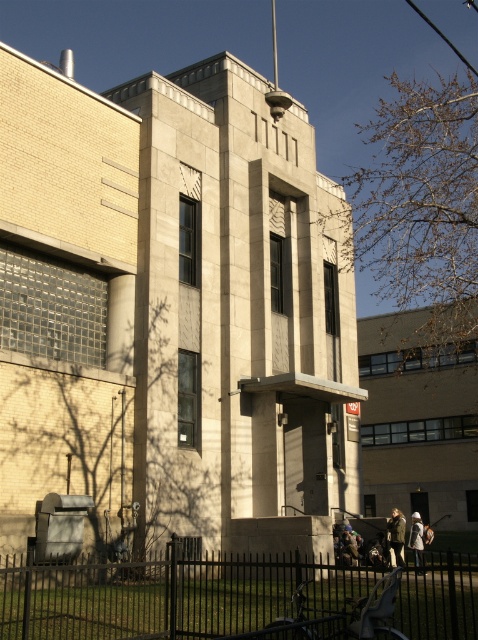
Question: Can you confirm if black metal fence at lower center is wider than white cotton coat at lower right?

Choices:
 (A) no
 (B) yes

Answer: (B)

Question: Which of the following is the closest to the observer?

Choices:
 (A) (419, 513)
 (B) (10, 636)

Answer: (B)

Question: From the image, what is the correct spatial relationship of black metal fence at lower center in relation to camouflage jacket at lower right?

Choices:
 (A) below
 (B) above

Answer: (B)

Question: Is black metal fence at lower center smaller than camouflage jacket at lower right?

Choices:
 (A) no
 (B) yes

Answer: (A)

Question: Which point appears farthest from the camera in this image?

Choices:
 (A) (422, 570)
 (B) (393, 557)

Answer: (B)

Question: Which object is positioned closest to the white cotton coat at lower right?

Choices:
 (A) camouflage jacket at lower right
 (B) black metal fence at lower center

Answer: (A)